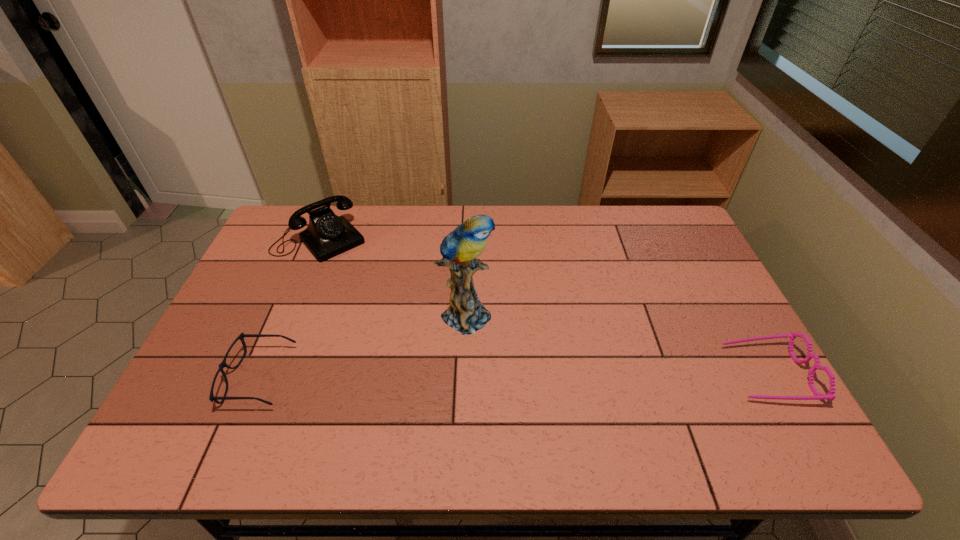
Locate an element on the screen. This screenshot has height=540, width=960. free spot on the desktop that is between the shortest object and the third tallest object and is positioned on the front face of the telephone is located at coordinates (438, 376).

At what (x,y) coordinates should I click in order to perform the action: click on free space on the desktop that is between the shortest object and the rightmost object and is positioned on the face of the third nearest object. Please return your answer as a coordinate pair (x, y). This screenshot has height=540, width=960. Looking at the image, I should click on (579, 375).